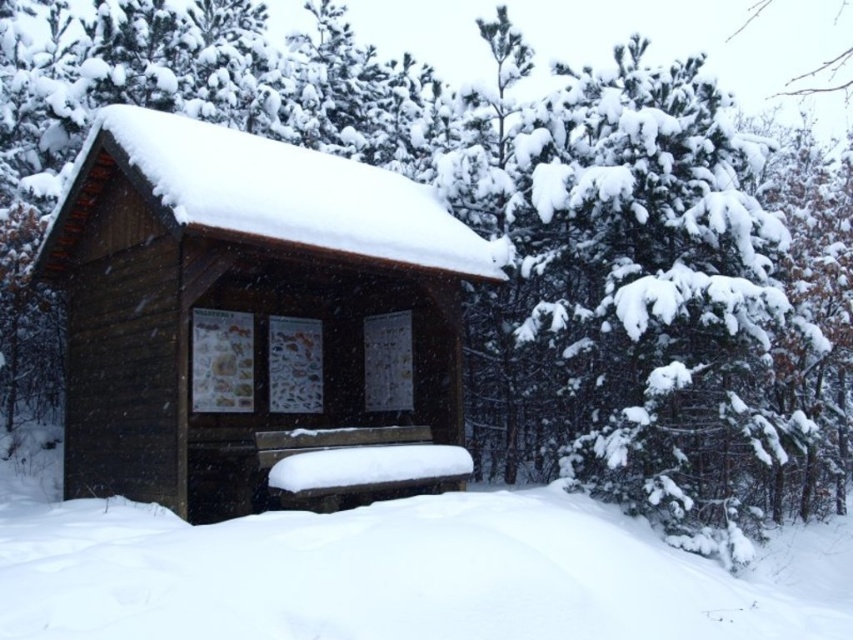
Question: Is wooden log cabin at center positioned behind white fluffy snow at lower center?

Choices:
 (A) no
 (B) yes

Answer: (B)

Question: Can you confirm if wooden log cabin at center is positioned above white fluffy snow at lower center?

Choices:
 (A) no
 (B) yes

Answer: (B)

Question: Which point appears closest to the camera in this image?

Choices:
 (A) (80, 618)
 (B) (250, 268)

Answer: (A)

Question: Which of the following is the farthest from the observer?

Choices:
 (A) wooden log cabin at center
 (B) white fluffy snow at lower center

Answer: (A)

Question: Considering the relative positions of wooden log cabin at center and white fluffy snow at lower center in the image provided, where is wooden log cabin at center located with respect to white fluffy snow at lower center?

Choices:
 (A) above
 (B) below

Answer: (A)